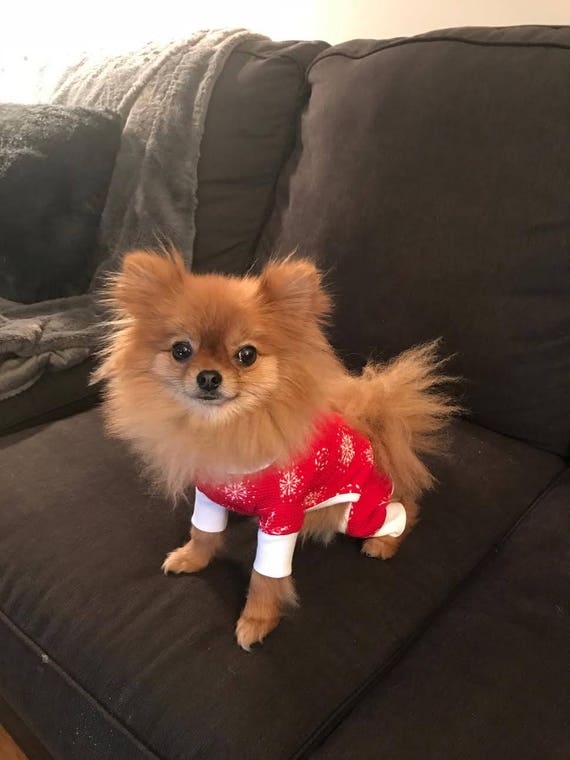
Where is `blanket`? blanket is located at coordinates (122, 214).